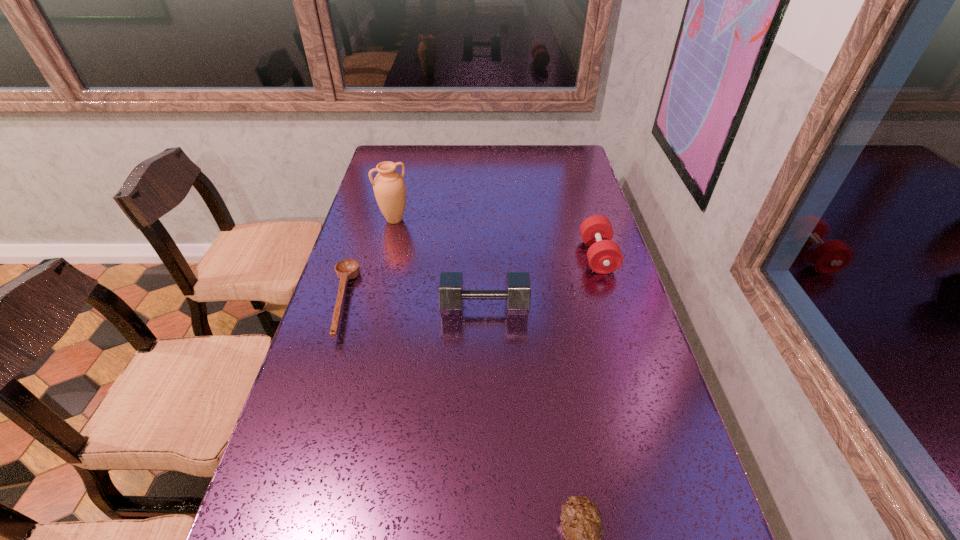
I want to click on urn, so click(x=389, y=187).

At what (x,y) coordinates should I click in order to perform the action: click on the farthest object. Please return your answer as a coordinate pair (x, y). The width and height of the screenshot is (960, 540). Looking at the image, I should click on (389, 187).

Where is `the left dumbbell`? The height and width of the screenshot is (540, 960). the left dumbbell is located at coordinates (517, 295).

Find the location of `the nearer dumbbell`. the nearer dumbbell is located at coordinates click(517, 295).

This screenshot has width=960, height=540. What are the coordinates of `the farther dumbbell` in the screenshot? It's located at (604, 256).

Identify the location of the rightmost object. (604, 256).

Where is `the shortest object`? This screenshot has width=960, height=540. the shortest object is located at coordinates (347, 269).

Identify the location of the leftmost object. The image size is (960, 540). (347, 269).

The height and width of the screenshot is (540, 960). Identify the location of vacant space positioned on the right of the tallest object. (424, 220).

This screenshot has height=540, width=960. Find the location of `vacant area situated on the right of the nearer dumbbell`. vacant area situated on the right of the nearer dumbbell is located at coordinates (604, 308).